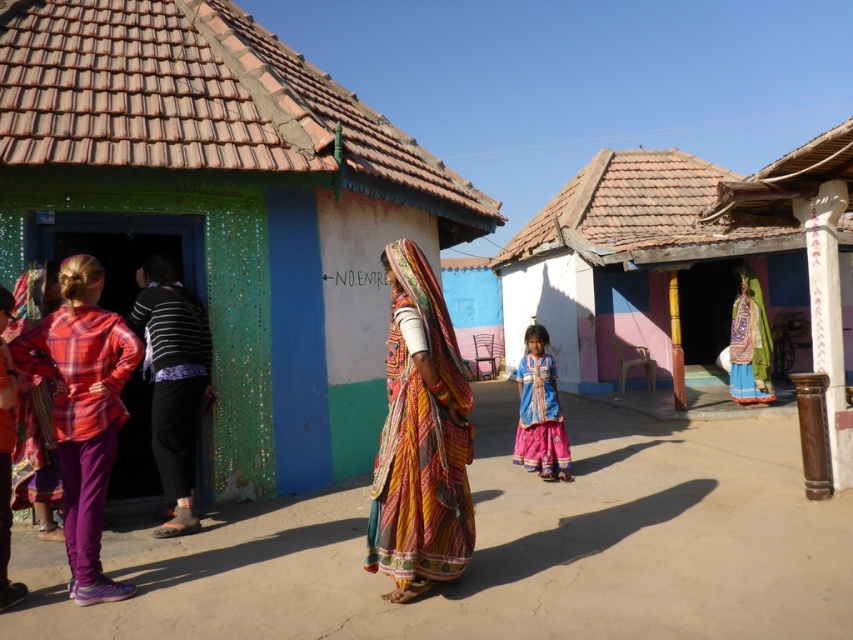
Looking at this image, you are standing at the origin point in the rural scene. Where is the white painted wood hut at center located in terms of coordinates?

The white painted wood hut at center is located at coordinates point (x=637, y=266).

You are a traveler standing in the rural area and want to take a photo of both the white painted wood hut at center and the blue cotton dress at center. Since you want to include both in the same frame, which object should you focus on first to ensure both are visible?

The white painted wood hut at center is located above the blue cotton dress at center, so you should focus on the white painted wood hut at center first to ensure both are visible in the frame.